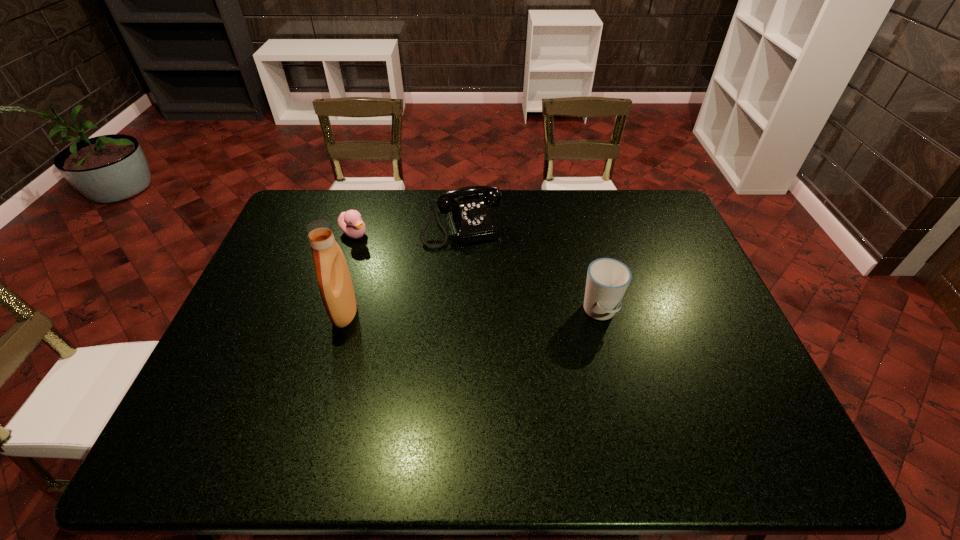
This screenshot has width=960, height=540. I want to click on free space on the desktop that is between the detergent and the rightmost object and is positioned on the front-facing side of the duckling, so click(x=474, y=312).

Find the location of a particular element. The height and width of the screenshot is (540, 960). free space on the desktop that is between the tallest object and the cup and is positioned on the dial of the telephone is located at coordinates (492, 312).